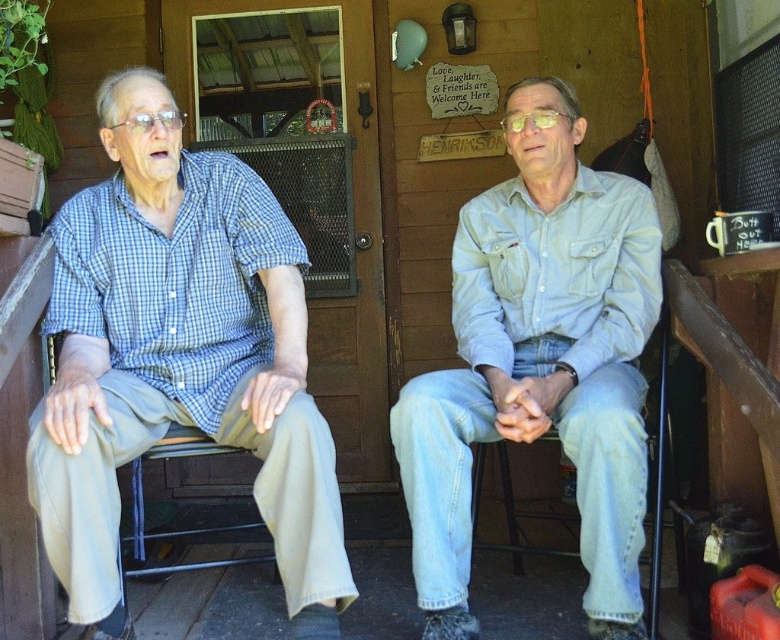
Question: Which point is farther from the camera taking this photo?

Choices:
 (A) (477, 268)
 (B) (126, 96)
 (C) (663, 378)

Answer: (A)

Question: Is matte blue plaid shirt at left to the right of denim jeans at center from the viewer's perspective?

Choices:
 (A) yes
 (B) no

Answer: (B)

Question: Which point is farther to the camera?

Choices:
 (A) matte blue plaid shirt at left
 (B) light blue denim jeans at center
 (C) denim jeans at center

Answer: (C)

Question: Among these objects, which one is farthest from the camera?

Choices:
 (A) denim jeans at center
 (B) light blue denim jeans at center
 (C) matte blue plaid shirt at left

Answer: (A)

Question: Can you confirm if matte blue plaid shirt at left is positioned below denim jeans at center?

Choices:
 (A) yes
 (B) no

Answer: (B)

Question: Does matte blue plaid shirt at left come in front of denim jeans at center?

Choices:
 (A) no
 (B) yes

Answer: (B)